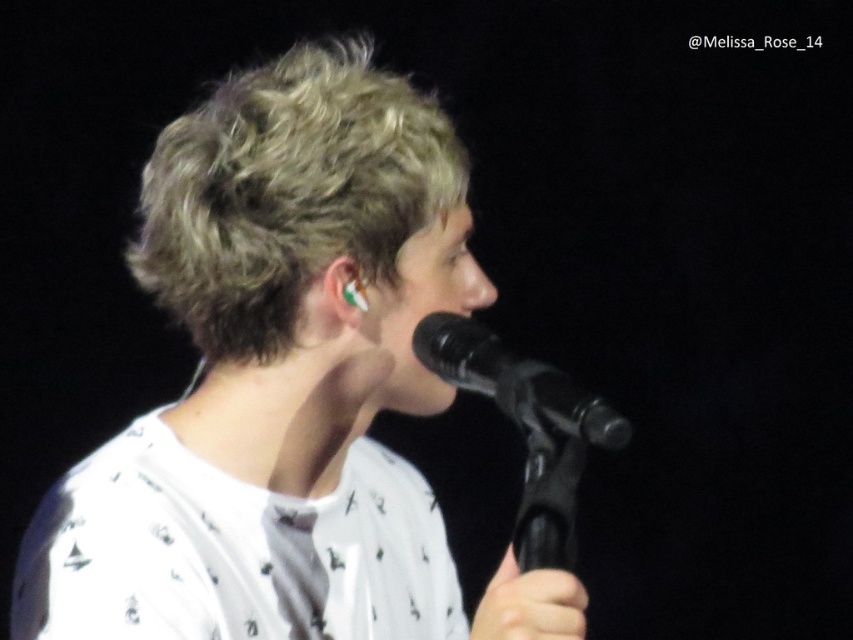
Between blonde curly hair at center and black matte microphone at center, which one is positioned lower?

Positioned lower is black matte microphone at center.

Is blonde curly hair at center smaller than black matte microphone at center?

Incorrect, blonde curly hair at center is not smaller in size than black matte microphone at center.

What do you see at coordinates (288, 193) in the screenshot? I see `blonde curly hair at center` at bounding box center [288, 193].

Where is `blonde curly hair at center`? Image resolution: width=853 pixels, height=640 pixels. blonde curly hair at center is located at coordinates (288, 193).

Who is lower down, white printed shirt at center or black matte microphone at center?

Positioned lower is black matte microphone at center.

Does white printed shirt at center have a smaller size compared to black matte microphone at center?

Actually, white printed shirt at center might be larger than black matte microphone at center.

Where is `white printed shirt at center`? The width and height of the screenshot is (853, 640). white printed shirt at center is located at coordinates (285, 385).

How far apart are white printed shirt at center and blonde curly hair at center?

white printed shirt at center is 2.71 inches away from blonde curly hair at center.

Identify the location of white printed shirt at center. Image resolution: width=853 pixels, height=640 pixels. (285, 385).

Where is `white printed shirt at center`? The image size is (853, 640). white printed shirt at center is located at coordinates (285, 385).

Locate an element on the screen. This screenshot has width=853, height=640. white printed shirt at center is located at coordinates (285, 385).